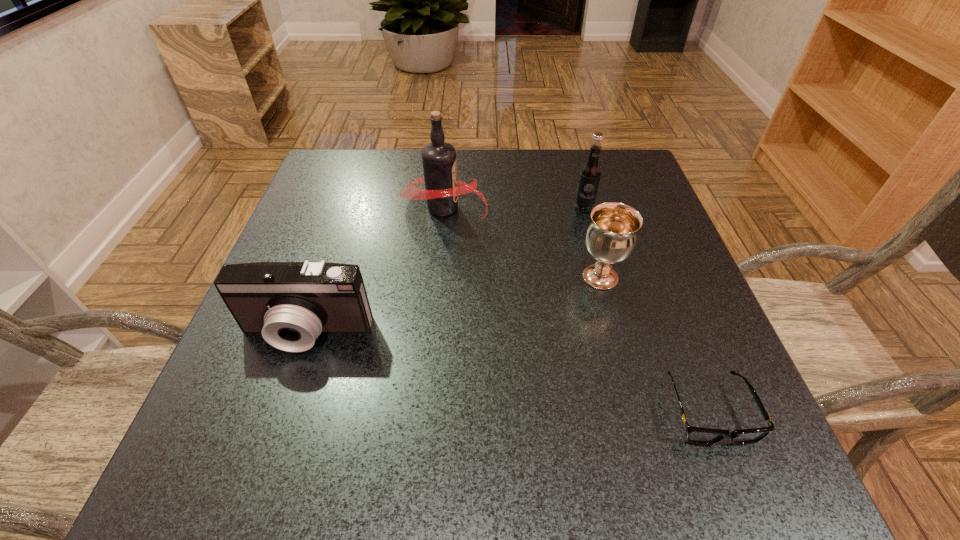
Where is `free space that is in between the tallest object and the fourth shortest object`? free space that is in between the tallest object and the fourth shortest object is located at coordinates (514, 207).

Identify the location of free spot between the camcorder and the fourth shortest object. Image resolution: width=960 pixels, height=540 pixels. (x=445, y=270).

Locate an element on the screen. vacant point located between the taller root beer and the right root beer is located at coordinates (514, 207).

Where is `unoccupied position between the left root beer and the right root beer`? This screenshot has height=540, width=960. unoccupied position between the left root beer and the right root beer is located at coordinates (514, 207).

The width and height of the screenshot is (960, 540). What are the coordinates of `object that is the third closest to the fourth farthest object` in the screenshot? It's located at (695, 435).

Identify which object is located as the nearest to the tallest object. Please provide its 2D coordinates. Your answer should be formatted as a tuple, i.e. [(x, y)], where the tuple contains the x and y coordinates of a point satisfying the conditions above.

[(611, 237)]

Find the location of a particular element. vacant area that satisfies the following two spatial constraints: 1. on the label of the second object from left to right; 2. on the lens of the camcorder is located at coordinates (432, 333).

The image size is (960, 540). I want to click on vacant area that satisfies the following two spatial constraints: 1. on the label of the fourth object from right to left; 2. on the back side of the third farthest object, so click(437, 278).